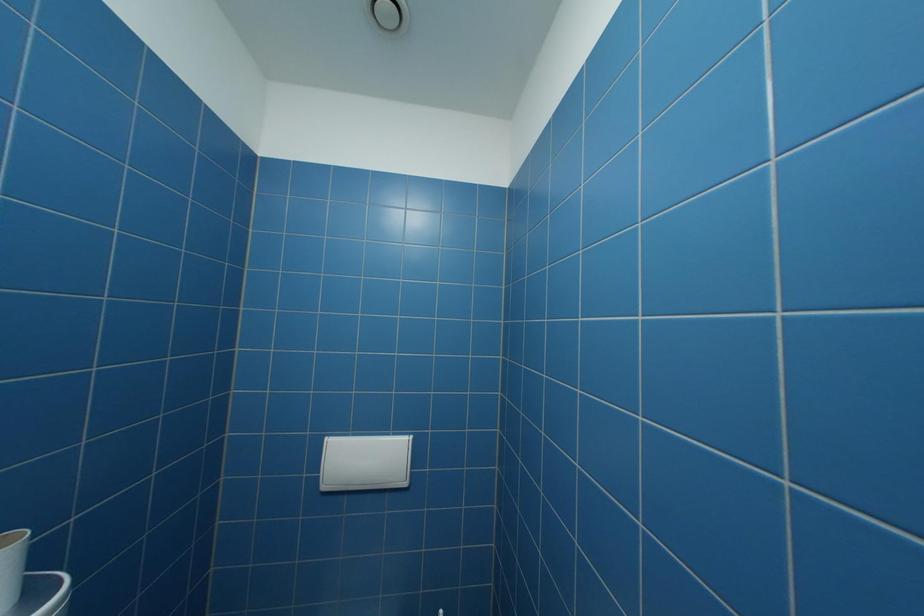
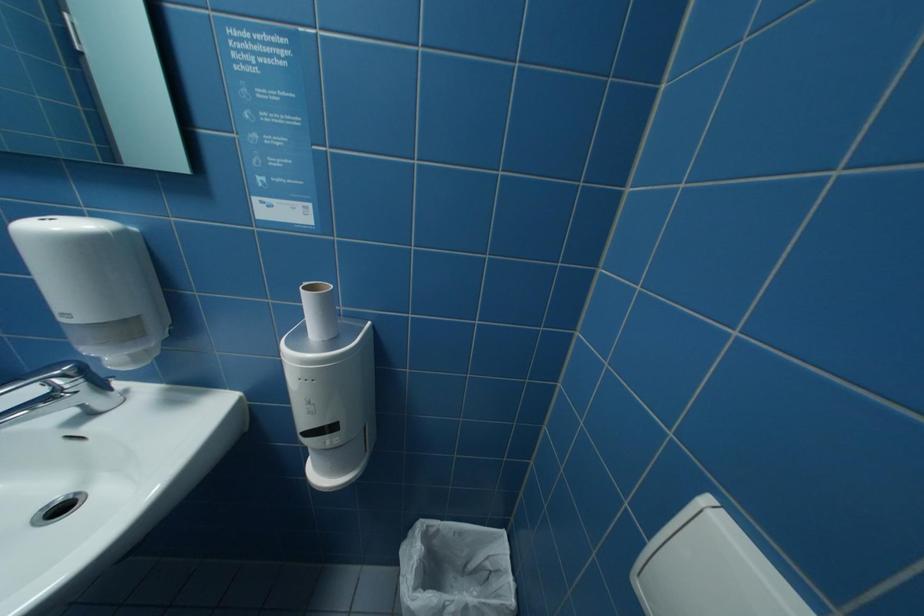
The images are taken continuously from a first-person perspective. In which direction is your viewpoint rotating?

The rotation direction of the camera is left-down.